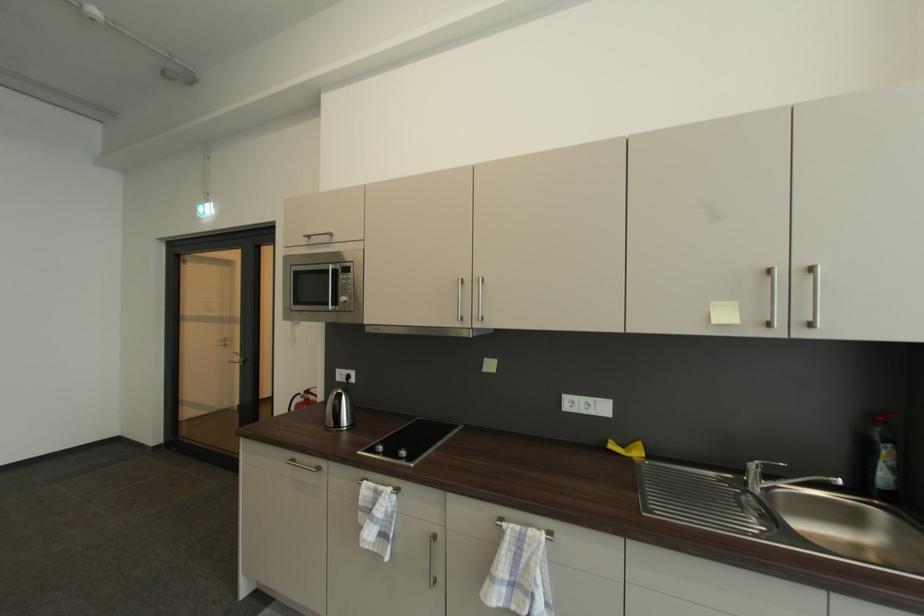
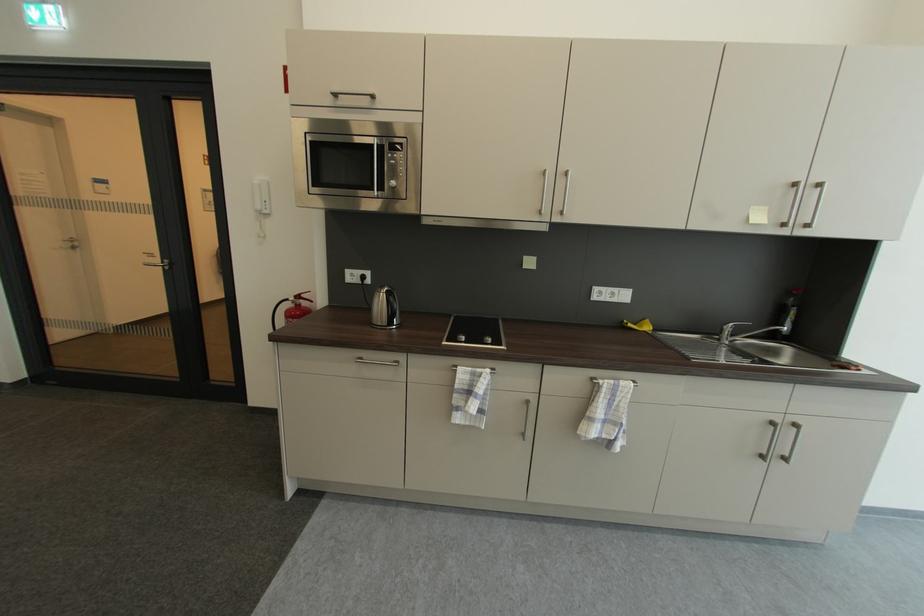
The point at (x=245, y=360) is marked in the first image. Where is the corresponding point in the second image?

(163, 262)